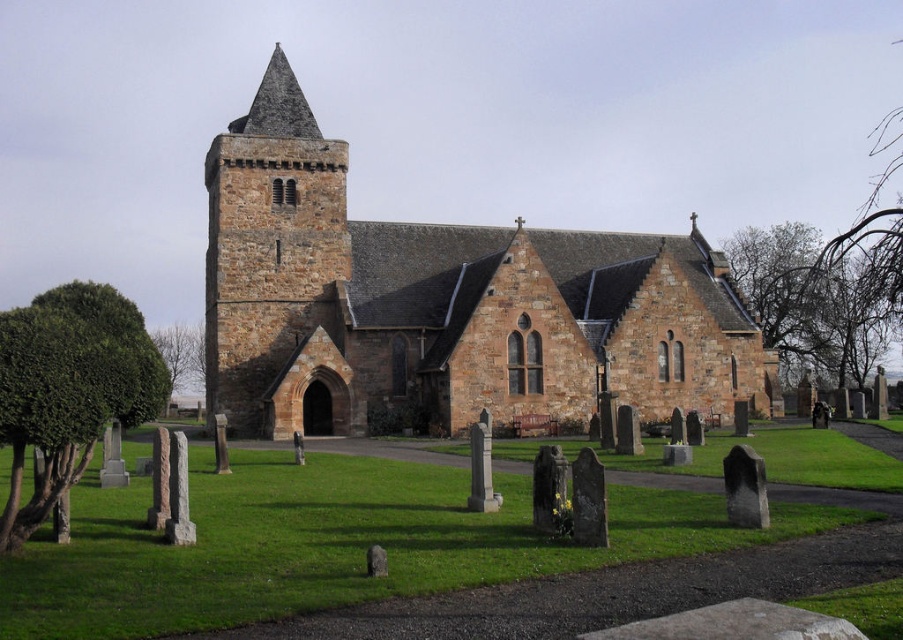
Between brown stone church at center and green leafy tree at lower left, which one has less height?

Standing shorter between the two is green leafy tree at lower left.

The image size is (903, 640). What do you see at coordinates (440, 301) in the screenshot?
I see `brown stone church at center` at bounding box center [440, 301].

Does point (425, 369) come in front of point (192, 381)?

Yes, it is in front of point (192, 381).

Where is `brown stone church at center`? Image resolution: width=903 pixels, height=640 pixels. brown stone church at center is located at coordinates (440, 301).

Is the position of brown stone church at center more distant than that of rustic stone tower at center-left?

Yes, it is.

Who is more distant from viewer, (621, 300) or (210, 288)?

Point (210, 288)

Which is in front, point (208, 216) or point (261, 205)?

Point (261, 205)

Identify the location of brown stone church at center. The height and width of the screenshot is (640, 903). (440, 301).

Does green leafy bush at lower left appear under green leafy tree at lower left?

Actually, green leafy bush at lower left is above green leafy tree at lower left.

Is green leafy bush at lower left bigger than green leafy tree at lower left?

Yes, green leafy bush at lower left is bigger than green leafy tree at lower left.

Who is more distant from viewer, (70, 426) or (180, 381)?

The point (180, 381) is more distant.

What are the coordinates of `green leafy bush at lower left` in the screenshot? It's located at (70, 388).